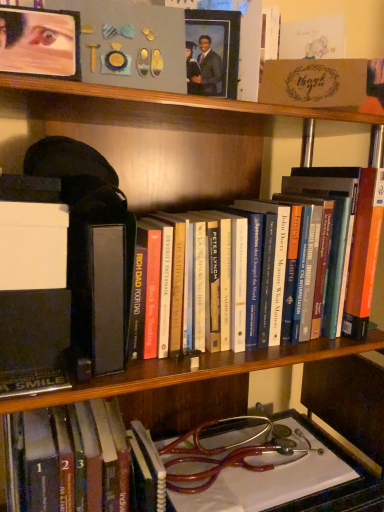
Question: From a real-world perspective, is matte black picture frame at upper center positioned above or below hardcover book at center, the first book in the bottom-to-top sequence?

Choices:
 (A) above
 (B) below

Answer: (A)

Question: Considering the positions of matte black picture frame at upper center and hardcover book at center, the first book in the bottom-to-top sequence, in the image, is matte black picture frame at upper center bigger or smaller than hardcover book at center, the first book in the bottom-to-top sequence,?

Choices:
 (A) big
 (B) small

Answer: (B)

Question: Estimate the real-world distances between objects in this image. Which object is farther from the hardcover book at center, the first book in the bottom-to-top sequence?

Choices:
 (A) matte black picture frame at upper center
 (B) hardcover book at center, the 1th book positioned from the top

Answer: (A)

Question: Considering the real-world distances, which object is closest to the hardcover book at center, the 1th book positioned from the top?

Choices:
 (A) hardcover book at center, the first book in the bottom-to-top sequence
 (B) matte black picture frame at upper center

Answer: (B)